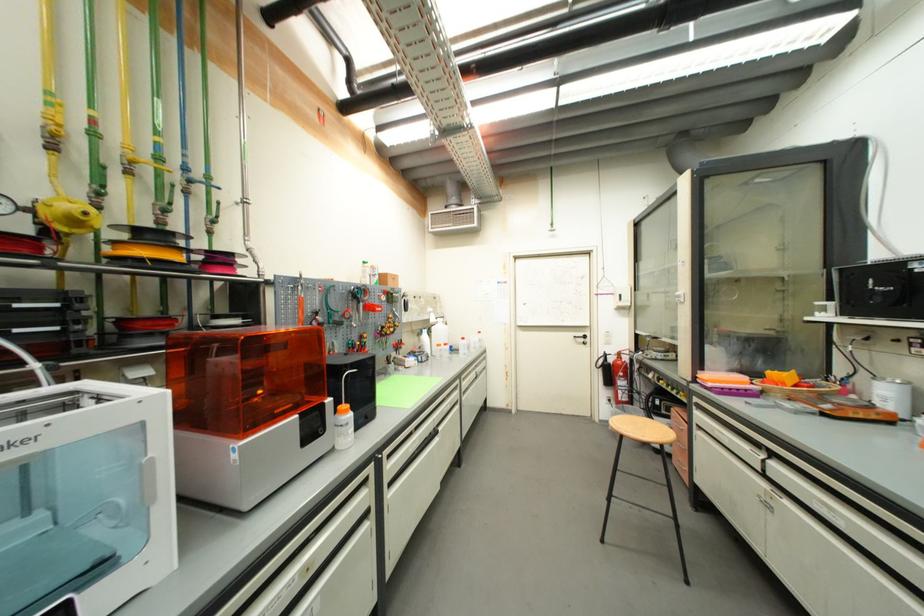
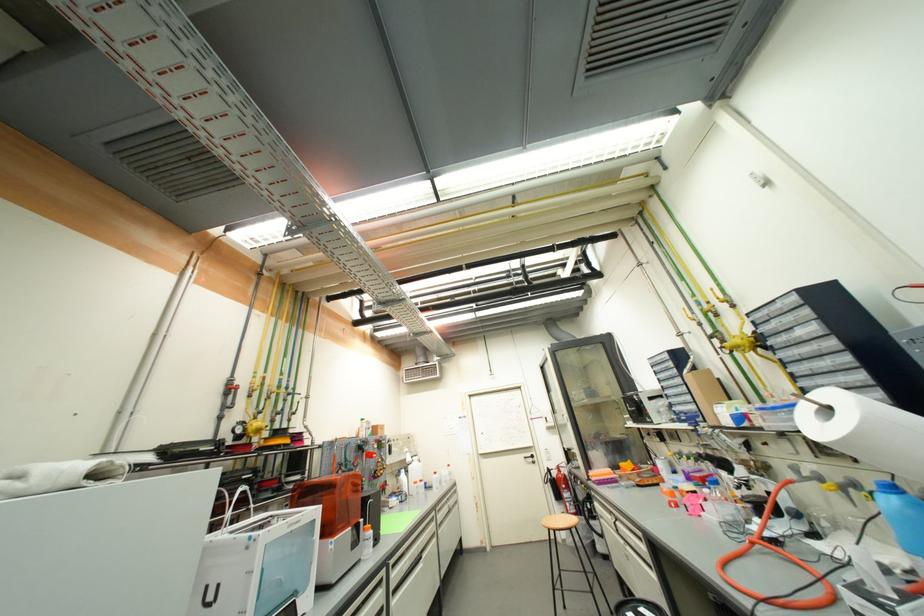
The point at (768,485) is marked in the first image. Where is the corresponding point in the second image?

(627, 543)